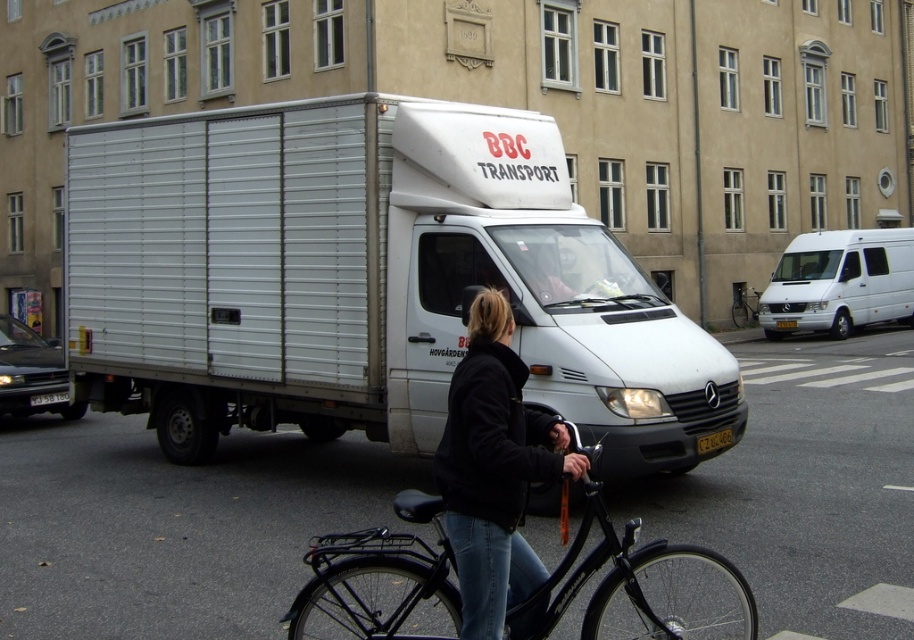
You are a delivery person who needs to load a package onto the BBC Transport van. You have a black soft jacket at center and a black matte bicycle at center. Which item can you place on top of the other without exceeding the van height limit?

The black soft jacket at center is shorter than the black matte bicycle at center, so you can place the black soft jacket at center on top of the black matte bicycle at center without exceeding the van height limit.

You are a delivery person trying to load a large package onto the white matte van at right. The package is as wide as the black soft jacket at center. Will the package fit inside the van?

The black soft jacket at center might be wider than white matte van at right, so the package might not fit inside the van if it is as wide as the jacket.

You are a delivery person who needs to move your black matte bicycle at center to the right side of the road. The white metallic truck at center is blocking the path. Can you move the bicycle around the truck to the right without going into the street?

The white metallic truck at center is positioned on the left side of black matte bicycle at center, so you can move the bicycle to the right side of the road by going around the truck on its right side, avoiding the street.